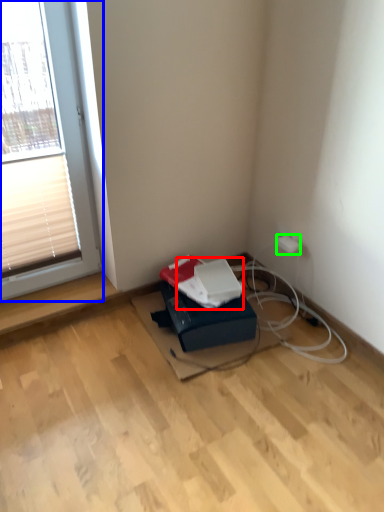
Question: Which is farther away from paperback book (highlighted by a red box)? window (highlighted by a blue box) or electric outlet (highlighted by a green box)?

Choices:
 (A) window
 (B) electric outlet

Answer: (A)